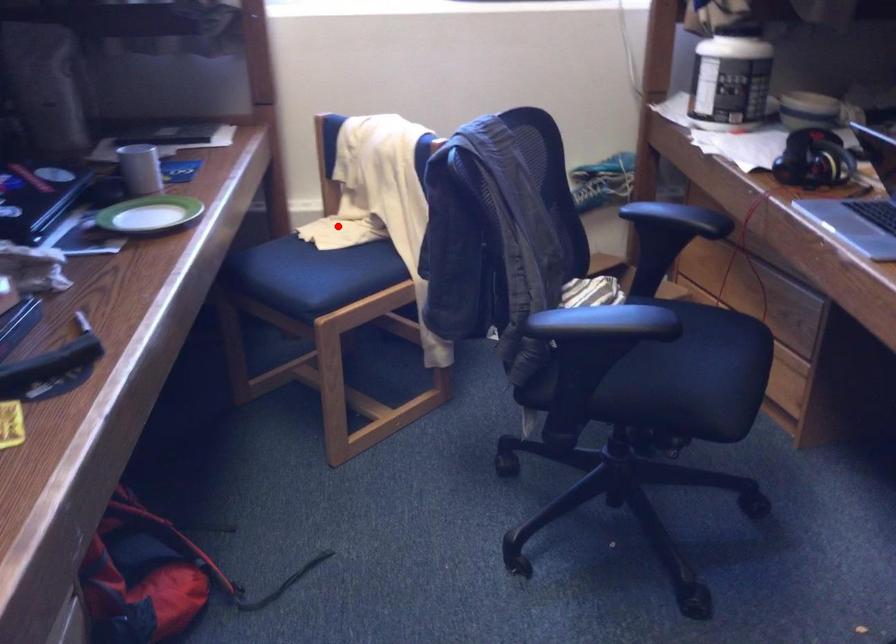
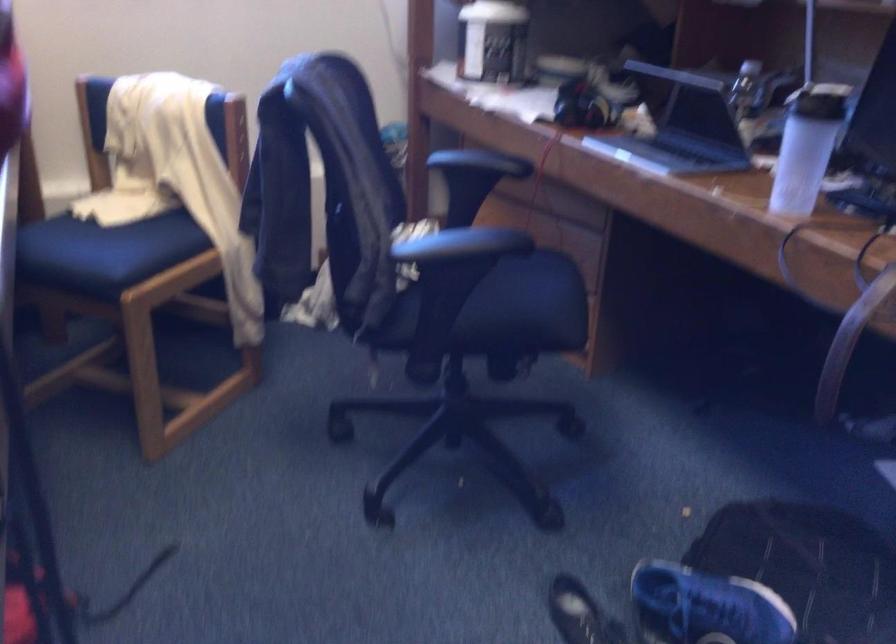
Question: I am providing you with two images of the same scene from different viewpoints. Given a red point in image1, look at the same physical point in image2. Is it:

Choices:
 (A) Closer to the viewpoint
 (B) Farther from the viewpoint

Answer: (A)